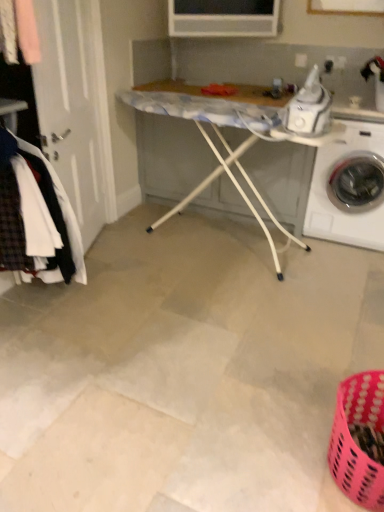
Question: Is white tile floor at center placed right next to white plastic ironing board at center?

Choices:
 (A) no
 (B) yes

Answer: (A)

Question: Considering the relative sizes of white tile floor at center and white plastic ironing board at center in the image provided, is white tile floor at center smaller than white plastic ironing board at center?

Choices:
 (A) no
 (B) yes

Answer: (B)

Question: Considering the relative sizes of white tile floor at center and white plastic ironing board at center in the image provided, is white tile floor at center thinner than white plastic ironing board at center?

Choices:
 (A) yes
 (B) no

Answer: (B)

Question: Can you confirm if white tile floor at center is taller than white plastic ironing board at center?

Choices:
 (A) no
 (B) yes

Answer: (A)

Question: From the image's perspective, is white tile floor at center located beneath white plastic ironing board at center?

Choices:
 (A) yes
 (B) no

Answer: (A)

Question: Does white tile floor at center lie in front of white plastic ironing board at center?

Choices:
 (A) no
 (B) yes

Answer: (B)

Question: Does white plastic ironing board at center have a greater width compared to white tile floor at center?

Choices:
 (A) no
 (B) yes

Answer: (A)

Question: From a real-world perspective, is white plastic ironing board at center physically below white tile floor at center?

Choices:
 (A) yes
 (B) no

Answer: (B)

Question: Does white plastic ironing board at center appear on the right side of white tile floor at center?

Choices:
 (A) no
 (B) yes

Answer: (B)

Question: Could you tell me if white plastic ironing board at center is turned towards white tile floor at center?

Choices:
 (A) yes
 (B) no

Answer: (A)

Question: Is white plastic ironing board at center oriented away from white tile floor at center?

Choices:
 (A) no
 (B) yes

Answer: (A)

Question: From a real-world perspective, is white plastic ironing board at center positioned over white tile floor at center based on gravity?

Choices:
 (A) no
 (B) yes

Answer: (B)

Question: Is plaid wool coat at left completely or partially outside of white glossy washing machine at right?

Choices:
 (A) yes
 (B) no

Answer: (A)